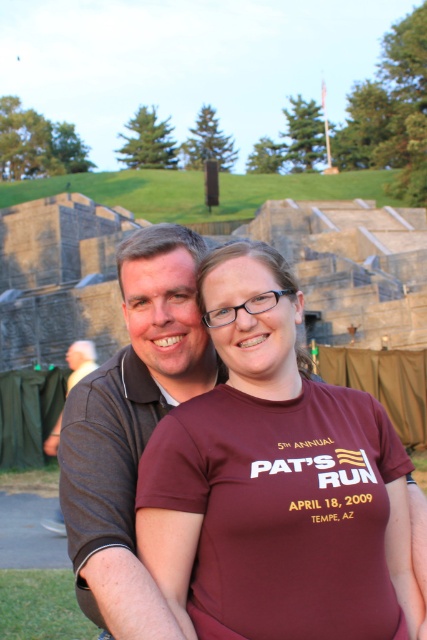
Which is more to the right, maroon t-shirt at center or dark gray polo shirt at center?

From the viewer's perspective, maroon t-shirt at center appears more on the right side.

The width and height of the screenshot is (427, 640). Identify the location of maroon t-shirt at center. (269, 483).

Is dark gray polo shirt at center further to the viewer compared to brown fabric shirt at left?

That is False.

Who is positioned more to the right, dark gray polo shirt at center or brown fabric shirt at left?

dark gray polo shirt at center is more to the right.

Find the location of a particular element. Image resolution: width=427 pixels, height=640 pixels. dark gray polo shirt at center is located at coordinates (131, 426).

In the scene shown: Can you confirm if maroon t-shirt at center is wider than brown fabric shirt at left?

Correct, the width of maroon t-shirt at center exceeds that of brown fabric shirt at left.

Which of these two, maroon t-shirt at center or brown fabric shirt at left, stands taller?

maroon t-shirt at center is taller.

Which is behind, point (262, 444) or point (58, 435)?

Positioned behind is point (58, 435).

Find the location of a particular element. Image resolution: width=427 pixels, height=640 pixels. maroon t-shirt at center is located at coordinates (269, 483).